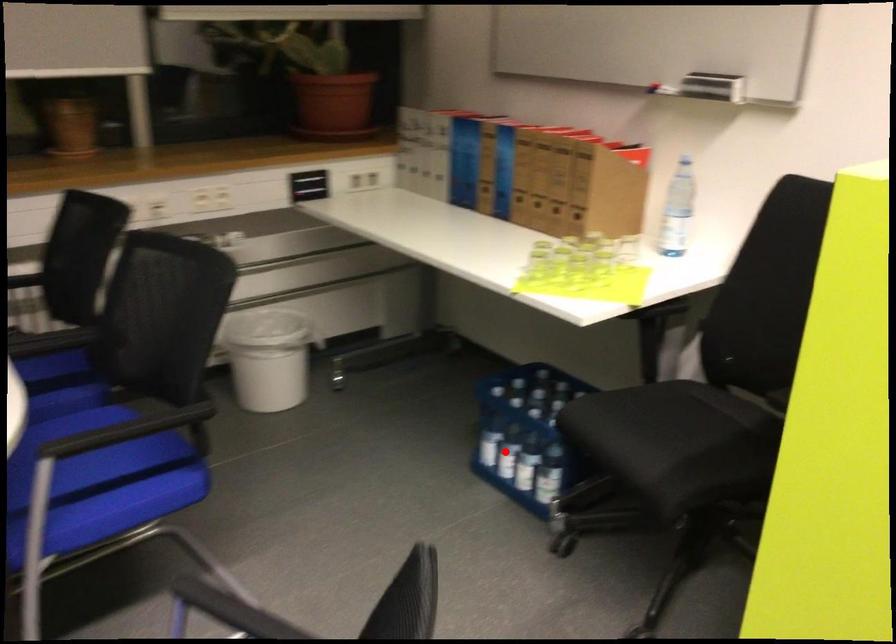
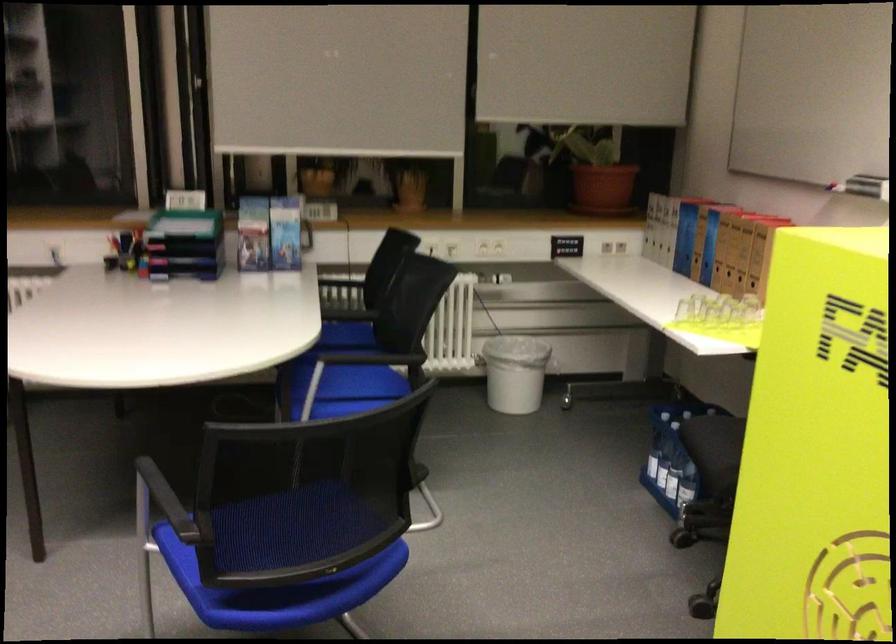
Question: I am providing you with two images of the same scene from different viewpoints. In image1, a red point is highlighted. Considering the same 3D point in image2, which of the following is correct?

Choices:
 (A) It is closer
 (B) It is farther

Answer: (B)